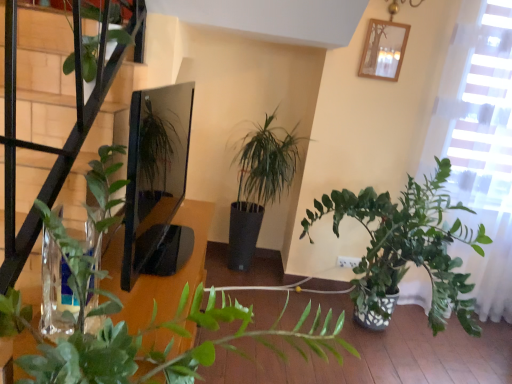
Question: Looking at the image, does green matte plant at center seem bigger or smaller compared to green leafy plant at upper left?

Choices:
 (A) big
 (B) small

Answer: (A)

Question: Is point (108, 301) closer or farther from the camera than point (117, 16)?

Choices:
 (A) closer
 (B) farther

Answer: (A)

Question: Estimate the real-world distances between objects in this image. Which object is closer to the green matte plant at center?

Choices:
 (A) green leafy plant at upper left
 (B) wooden picture frame at upper center

Answer: (A)

Question: Estimate the real-world distances between objects in this image. Which object is farther from the green matte plant at center?

Choices:
 (A) wooden picture frame at upper center
 (B) green leafy plant at upper left

Answer: (A)